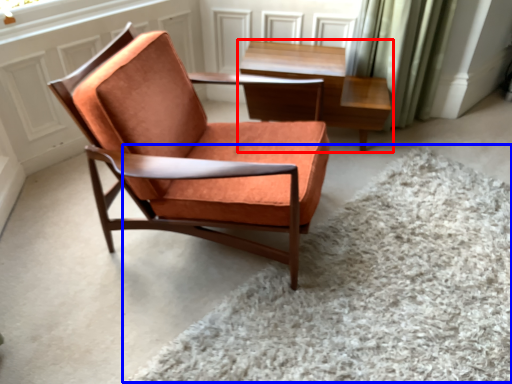
Question: Which object is further to the camera taking this photo, table (highlighted by a red box) or plain (highlighted by a blue box)?

Choices:
 (A) table
 (B) plain

Answer: (A)